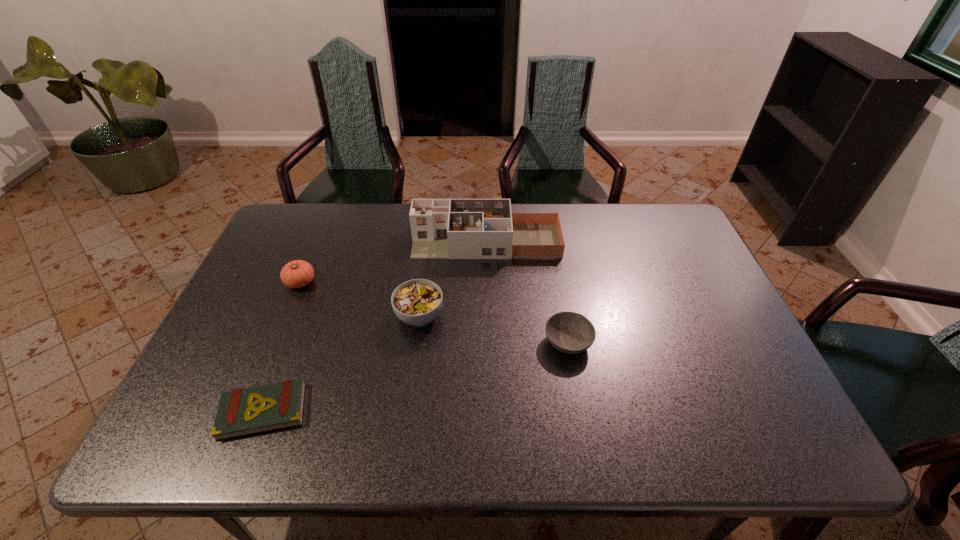
Image resolution: width=960 pixels, height=540 pixels. Find the location of `vacant area that lies between the nearest object and the second shortest object`. vacant area that lies between the nearest object and the second shortest object is located at coordinates (416, 377).

Where is `free area in between the second shortest object and the nearest object`? free area in between the second shortest object and the nearest object is located at coordinates (416, 377).

Where is `object that is the second closest to the book`? object that is the second closest to the book is located at coordinates pos(298,273).

Identify which object is the third nearest to the tallest object. Please provide its 2D coordinates. Your answer should be formatted as a tuple, i.e. [(x, y)], where the tuple contains the x and y coordinates of a point satisfying the conditions above.

[(298, 273)]

Where is `blank space that satisfies the following two spatial constraints: 1. on the back side of the second shortest object; 2. at the front door of the farthest object`? blank space that satisfies the following two spatial constraints: 1. on the back side of the second shortest object; 2. at the front door of the farthest object is located at coordinates (550, 241).

In order to click on vacant space that satisfies the following two spatial constraints: 1. at the front door of the farthest object; 2. on the left side of the second shortest object in this screenshot , I will do `click(488, 342)`.

This screenshot has width=960, height=540. Find the location of `blank space that satisfies the following two spatial constraints: 1. at the front door of the dollhouse; 2. on the front side of the fourth nearest object`. blank space that satisfies the following two spatial constraints: 1. at the front door of the dollhouse; 2. on the front side of the fourth nearest object is located at coordinates (487, 282).

Find the location of a particular element. This screenshot has height=540, width=960. blank space that satisfies the following two spatial constraints: 1. at the front door of the tallest object; 2. on the back side of the second shortest object is located at coordinates (488, 342).